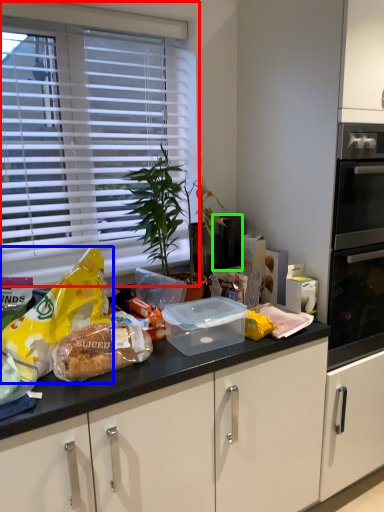
Question: Which object is the closest to the window blind (highlighted by a red box)? Choose among these: snack (highlighted by a blue box) or appliance (highlighted by a green box).

Choices:
 (A) snack
 (B) appliance

Answer: (A)